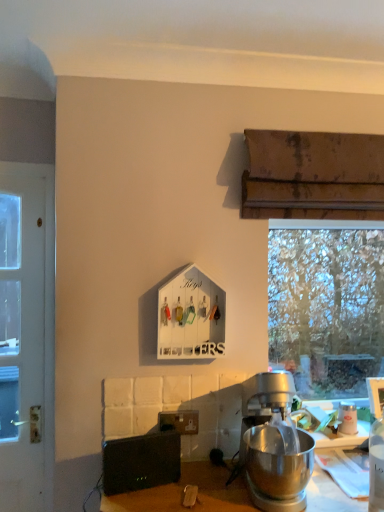
Question: Can you confirm if white painted wood door at left is thinner than transparent glass window at right?

Choices:
 (A) no
 (B) yes

Answer: (B)

Question: Considering the relative positions of white painted wood door at left and transparent glass window at right in the image provided, is white painted wood door at left to the right of transparent glass window at right from the viewer's perspective?

Choices:
 (A) yes
 (B) no

Answer: (B)

Question: Is the position of white painted wood door at left more distant than that of transparent glass window at right?

Choices:
 (A) no
 (B) yes

Answer: (A)

Question: Can you confirm if white painted wood door at left is smaller than transparent glass window at right?

Choices:
 (A) no
 (B) yes

Answer: (B)

Question: From the image's perspective, is white painted wood door at left located beneath transparent glass window at right?

Choices:
 (A) no
 (B) yes

Answer: (B)

Question: Relative to black plastic speaker at lower left, is white painted wood door at left in front or behind?

Choices:
 (A) front
 (B) behind

Answer: (B)

Question: Is white painted wood door at left situated inside black plastic speaker at lower left or outside?

Choices:
 (A) inside
 (B) outside

Answer: (B)

Question: Is point [3, 340] closer or farther from the camera than point [150, 483]?

Choices:
 (A) farther
 (B) closer

Answer: (A)

Question: From the image's perspective, relative to black plastic speaker at lower left, is white painted wood door at left above or below?

Choices:
 (A) below
 (B) above

Answer: (B)

Question: Is transparent glass window at right to the left or to the right of white painted wood door at left in the image?

Choices:
 (A) right
 (B) left

Answer: (A)

Question: In the image, is transparent glass window at right positioned in front of or behind white painted wood door at left?

Choices:
 (A) front
 (B) behind

Answer: (B)

Question: Do you think transparent glass window at right is within white painted wood door at left, or outside of it?

Choices:
 (A) outside
 (B) inside

Answer: (A)

Question: From a real-world perspective, relative to white painted wood door at left, is transparent glass window at right vertically above or below?

Choices:
 (A) below
 (B) above

Answer: (B)

Question: Would you say white glossy coffee cup at upper right is inside or outside black plastic speaker at lower left?

Choices:
 (A) inside
 (B) outside

Answer: (B)

Question: Considering the positions of white glossy coffee cup at upper right and black plastic speaker at lower left in the image, is white glossy coffee cup at upper right wider or thinner than black plastic speaker at lower left?

Choices:
 (A) wide
 (B) thin

Answer: (A)